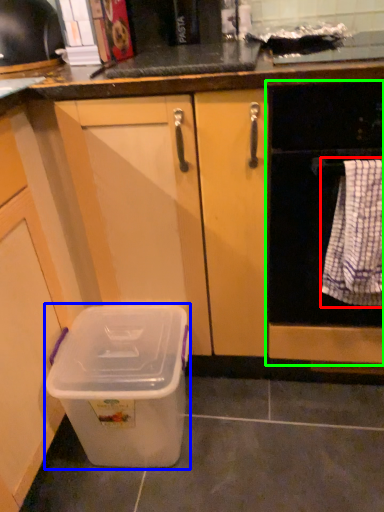
Question: Which object is the closest to the blanket (highlighted by a red box)? Choose among these: storage box (highlighted by a blue box) or home appliance (highlighted by a green box).

Choices:
 (A) storage box
 (B) home appliance

Answer: (B)